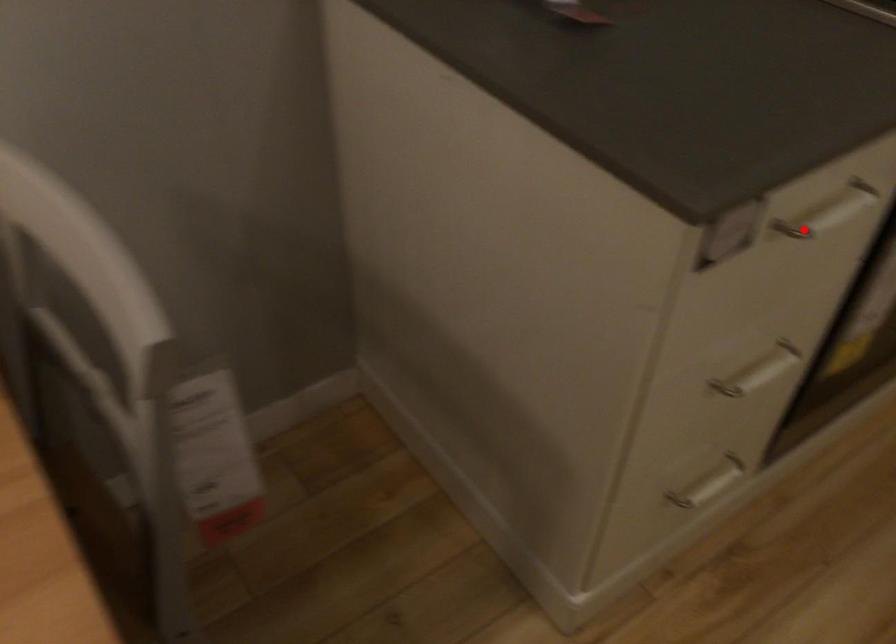
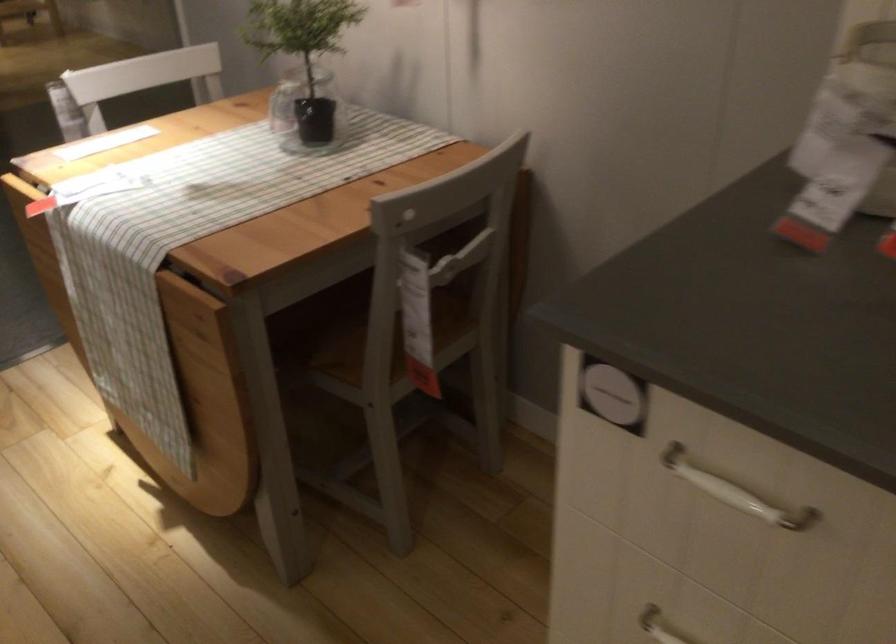
Question: I am providing you with two images of the same scene from different viewpoints. In image1, a red point is highlighted. Considering the same 3D point in image2, which of the following is correct?

Choices:
 (A) It is closer
 (B) It is farther

Answer: (A)